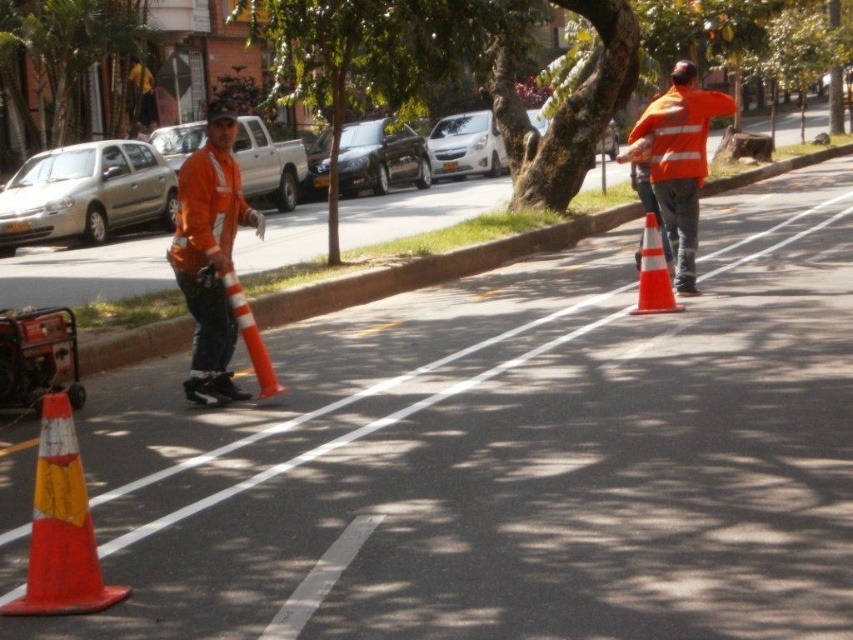
Is matte orange safety vest at center closer to the viewer compared to orange reflective safety vest at center?

Yes, matte orange safety vest at center is in front of orange reflective safety vest at center.

Which is behind, point (212, 257) or point (669, 97)?

Positioned behind is point (669, 97).

From the picture: Who is more distant from viewer, (178, 179) or (688, 168)?

The point (688, 168) is behind.

I want to click on matte orange safety vest at center, so click(x=210, y=253).

Who is lower down, orange reflective cone at lower left or orange reflective safety vest at center?

orange reflective cone at lower left is below.

Could you measure the distance between orange reflective cone at lower left and orange reflective safety vest at center?

The distance of orange reflective cone at lower left from orange reflective safety vest at center is 25.56 feet.

Is point (55, 589) positioned behind point (715, 92)?

No, it is not.

This screenshot has width=853, height=640. Identify the location of orange reflective cone at lower left. (61, 525).

Is matte orange safety vest at center to the left of orange reflective cone at right from the viewer's perspective?

Indeed, matte orange safety vest at center is positioned on the left side of orange reflective cone at right.

Is point (224, 163) positioned before point (666, 268)?

Yes, it is in front of point (666, 268).

Between point (213, 323) and point (654, 285), which one is positioned in front?

Positioned in front is point (213, 323).

This screenshot has height=640, width=853. In order to click on matte orange safety vest at center in this screenshot , I will do `click(210, 253)`.